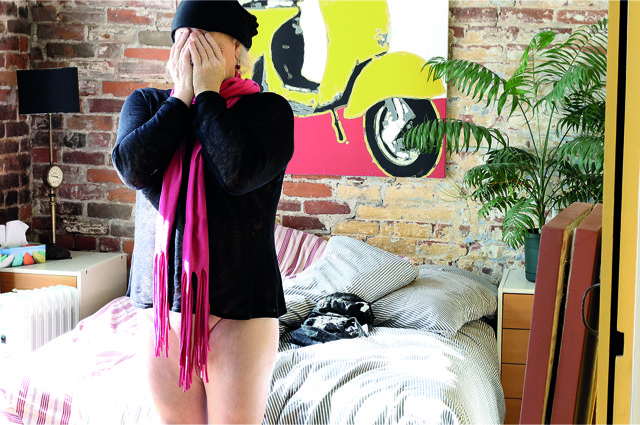
Locate an element on the screen. Image resolution: width=640 pixels, height=425 pixels. clock is located at coordinates (52, 180).